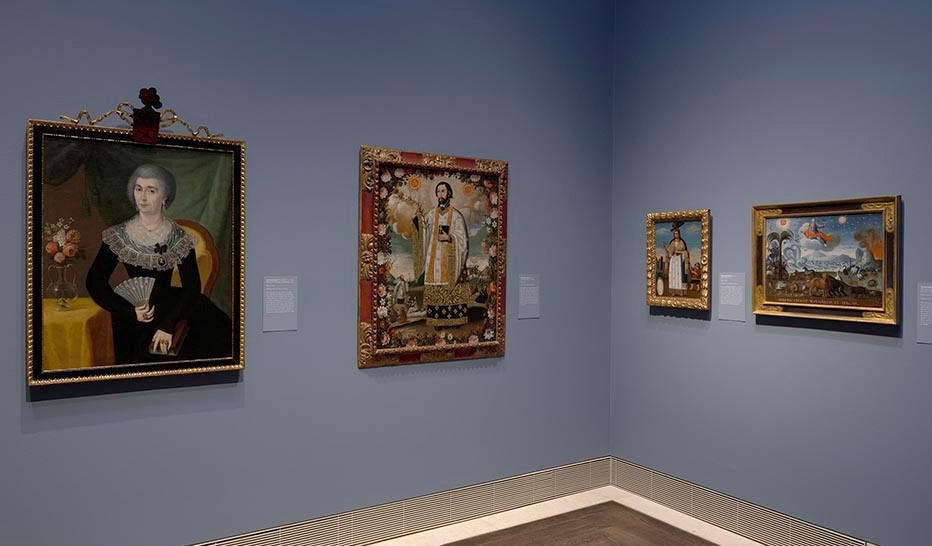
You are a GUI agent. You are given a task and a screenshot of the screen. Output one action in this format:
    pyautogui.click(x=<x>, y=<y>)
    Task: Click on the floor
    
    Given the screenshot: What is the action you would take?
    pyautogui.click(x=618, y=529)